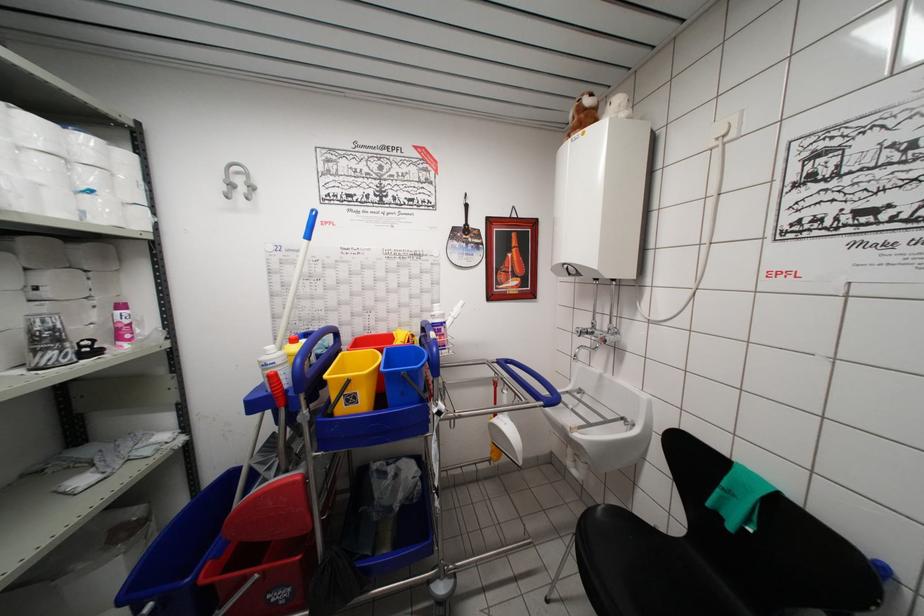
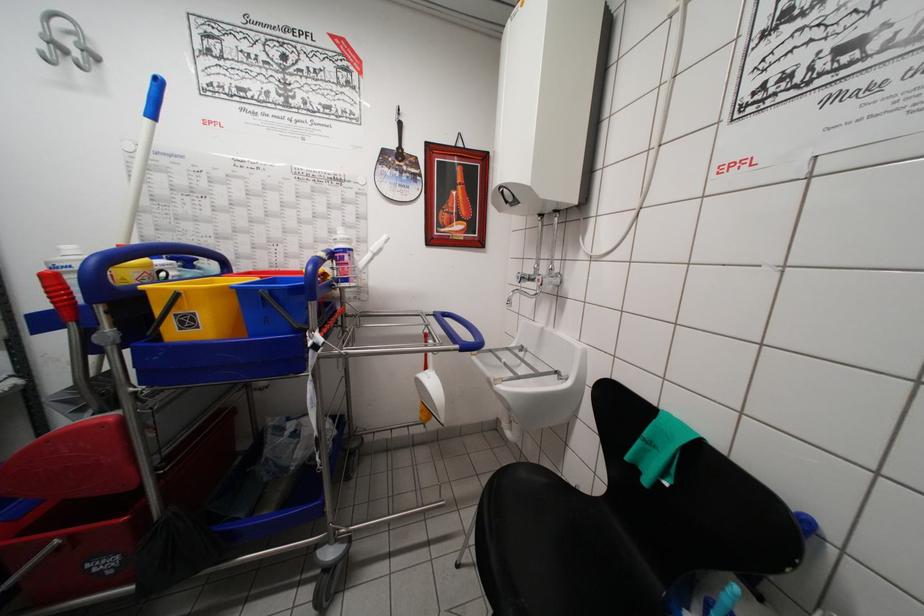
The images are taken continuously from a first-person perspective. In which direction are you moving?

The movement direction of the cameraman is right, forward.